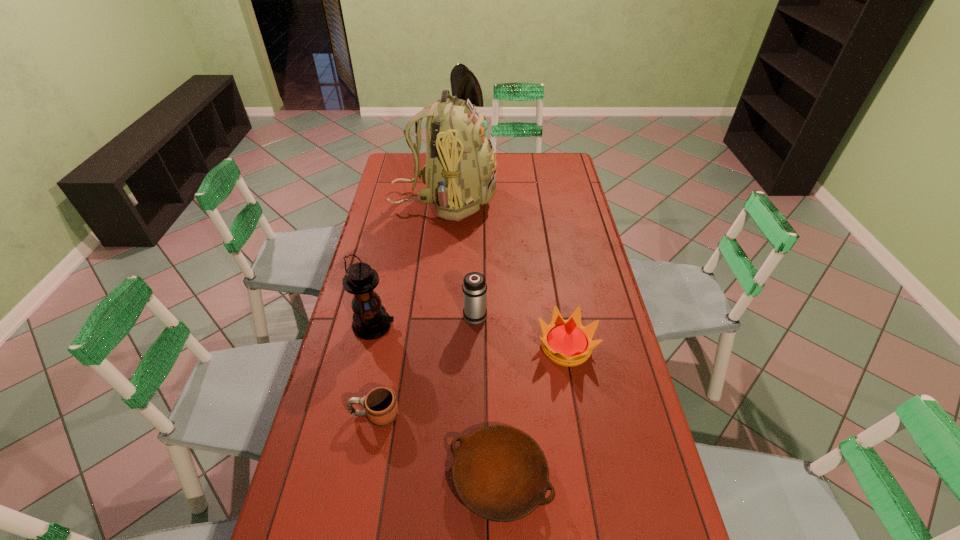
Locate an element on the screen. This screenshot has height=540, width=960. empty space that is in between the backpack and the shortest object is located at coordinates (472, 339).

Find the location of a particular element. This screenshot has width=960, height=540. vacant area that lies between the plate and the crown is located at coordinates (533, 412).

You are a GUI agent. You are given a task and a screenshot of the screen. Output one action in this format:
    pyautogui.click(x=<x>, y=<y>)
    Task: Click on the vacant area that lies between the plate and the fourth tallest object
    The height and width of the screenshot is (540, 960).
    Given the screenshot: What is the action you would take?
    pyautogui.click(x=533, y=412)

Locate an element on the screen. empty space between the lantern and the farthest object is located at coordinates (409, 263).

Where is `free space between the mug and the plate`? free space between the mug and the plate is located at coordinates click(x=438, y=446).

Find the location of a particular element. The height and width of the screenshot is (540, 960). the closest object to the second tallest object is located at coordinates (381, 407).

I want to click on object that is the second closest to the plate, so click(x=567, y=343).

This screenshot has width=960, height=540. I want to click on free point that satisfies the following two spatial constraints: 1. above the crown, indicating its light source; 2. on the right side of the fifth shortest object, so click(x=369, y=347).

Where is `vacant space that satisfies the following two spatial constraints: 1. on the back side of the plate; 2. on the left side of the crown`? Image resolution: width=960 pixels, height=540 pixels. vacant space that satisfies the following two spatial constraints: 1. on the back side of the plate; 2. on the left side of the crown is located at coordinates (496, 347).

At what (x,y) coordinates should I click in order to perform the action: click on vacant area that satisfies the following two spatial constraints: 1. above the plate, indicating its light source; 2. on the left side of the second tallest object. Please return your answer as a coordinate pair (x, y). Looking at the image, I should click on (340, 477).